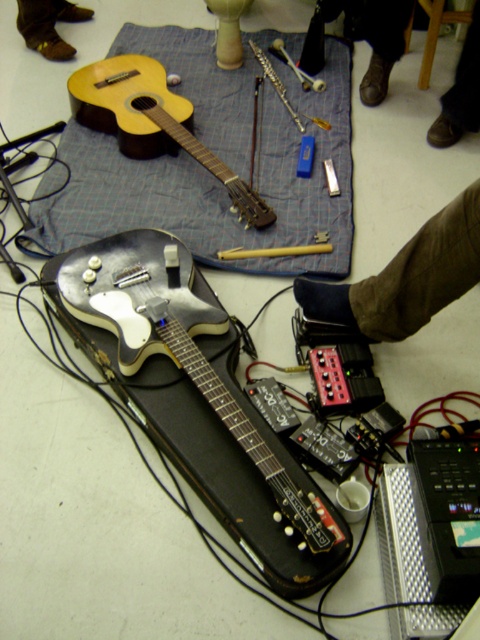
You are a stagehand setting up for a concert. You need to move the metallic silver electric guitar at center and the matte wood guitar at upper left to the same position. Which guitar should you move first to avoid blocking your view of the other?

You should move the metallic silver electric guitar at center first because it is closer to the viewer than the matte wood guitar at upper left. Moving the closer one first will keep it from blocking access to the other.

You are standing in front of the musical setup. You need to place a new item on the dark blue fabric at lower right. What are the coordinates where you should place it?

The coordinates for placing the new item on the dark blue fabric at lower right are at point (407, 276).

Based on the photo, you are setting up for a music performance and need to place a microphone stand between the dark blue fabric at lower right and the brown leather shoe at lower right. Based on their heights, which object should the stand be placed closer to?

The dark blue fabric at lower right has a lesser height compared to the brown leather shoe at lower right, so the microphone stand should be placed closer to the darker blue fabric at lower right to ensure stability and avoid obstruction from the taller shoe.